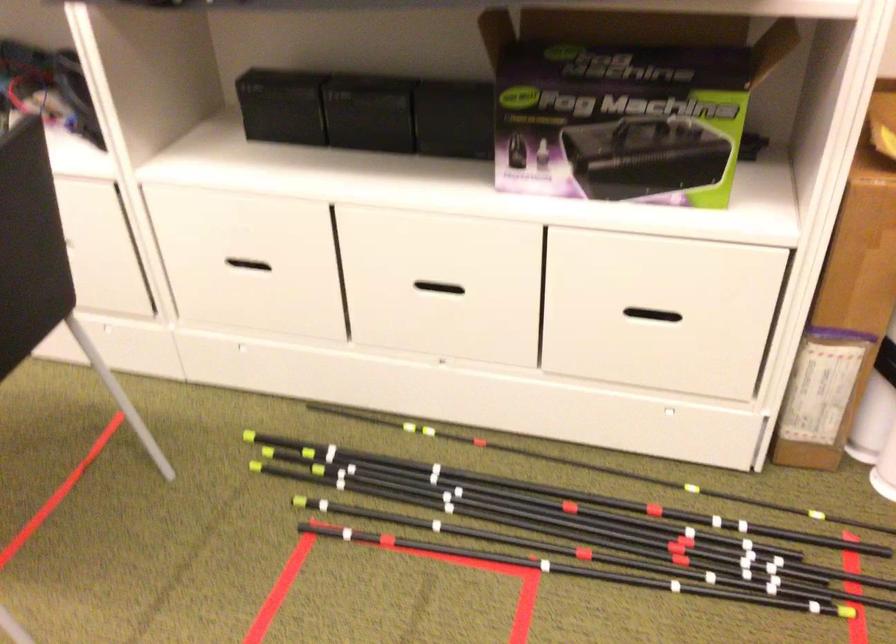
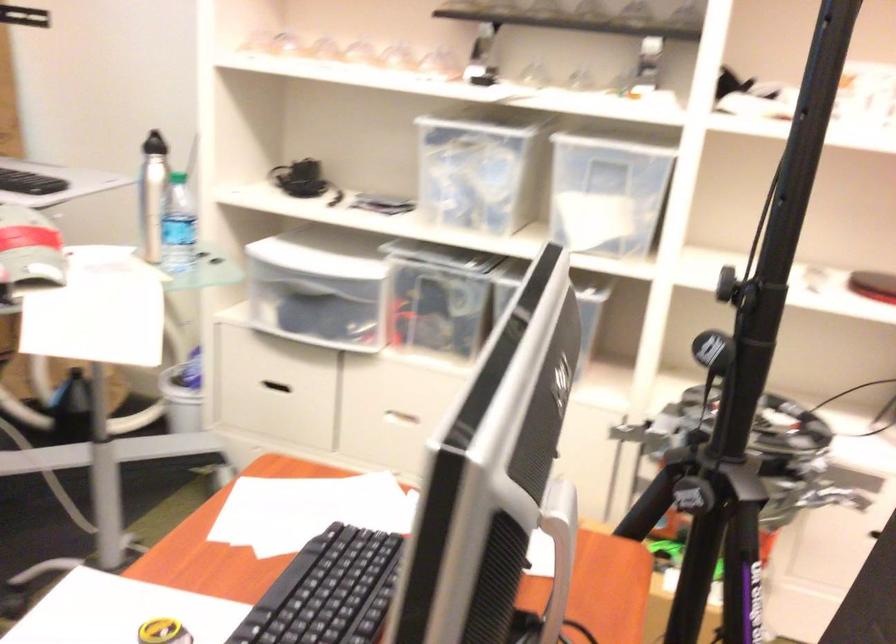
Question: What movement of the cameraman would produce the second image?

Choices:
 (A) Left
 (B) Right
 (C) Forward
 (D) Backward

Answer: (A)